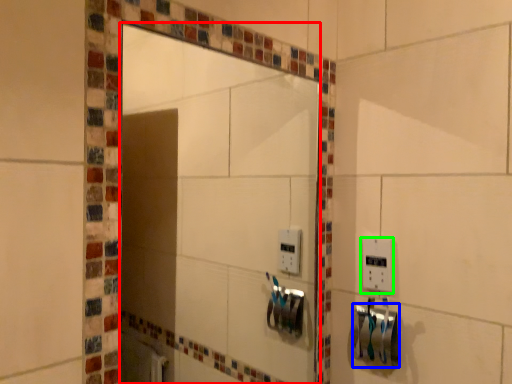
Question: Which object is the farthest from mirror (highlighted by a red box)? Choose among these: towel bar (highlighted by a blue box) or light switch (highlighted by a green box).

Choices:
 (A) towel bar
 (B) light switch

Answer: (B)